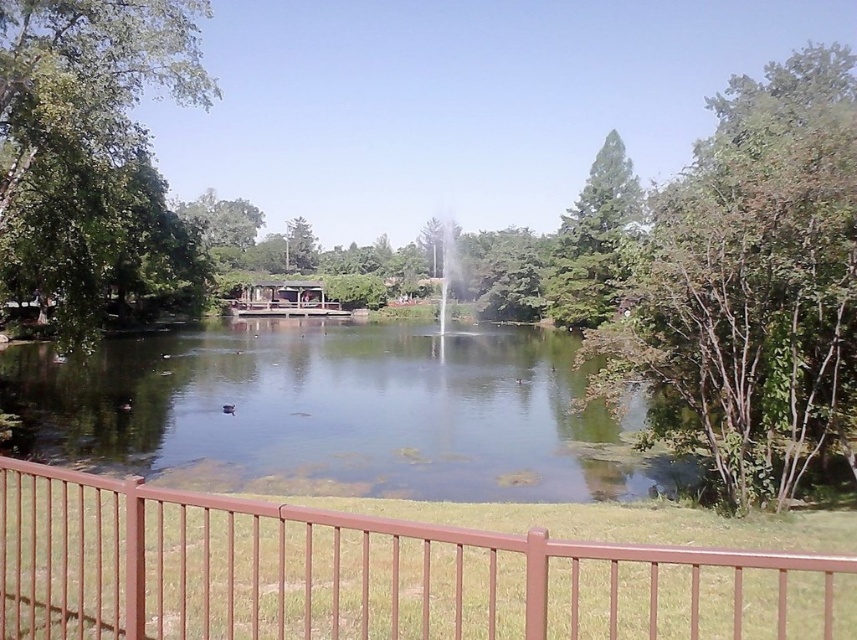
Does green leafy tree at right appear on the right side of green leafy tree at center?

Correct, you'll find green leafy tree at right to the right of green leafy tree at center.

Between green leafy tree at right and green leafy tree at center, which one appears on the right side from the viewer's perspective?

green leafy tree at right is more to the right.

The image size is (857, 640). What do you see at coordinates (748, 284) in the screenshot?
I see `green leafy tree at right` at bounding box center [748, 284].

Identify the location of green leafy tree at right. The image size is (857, 640). click(748, 284).

Can you confirm if green textured tree at upper right is wider than green leafy tree at center?

Yes, green textured tree at upper right is wider than green leafy tree at center.

Is green textured tree at upper right above green leafy tree at center?

Actually, green textured tree at upper right is below green leafy tree at center.

Identify the location of green textured tree at upper right. (592, 241).

This screenshot has width=857, height=640. Find the location of `green textured tree at upper right`. green textured tree at upper right is located at coordinates (592, 241).

Is brown metal fence at lower center above green leafy tree at right?

No.

The height and width of the screenshot is (640, 857). What do you see at coordinates (369, 573) in the screenshot?
I see `brown metal fence at lower center` at bounding box center [369, 573].

Is point (580, 577) positioned after point (790, 77)?

No, (580, 577) is closer to viewer.

Where is `brown metal fence at lower center`? The width and height of the screenshot is (857, 640). brown metal fence at lower center is located at coordinates (369, 573).